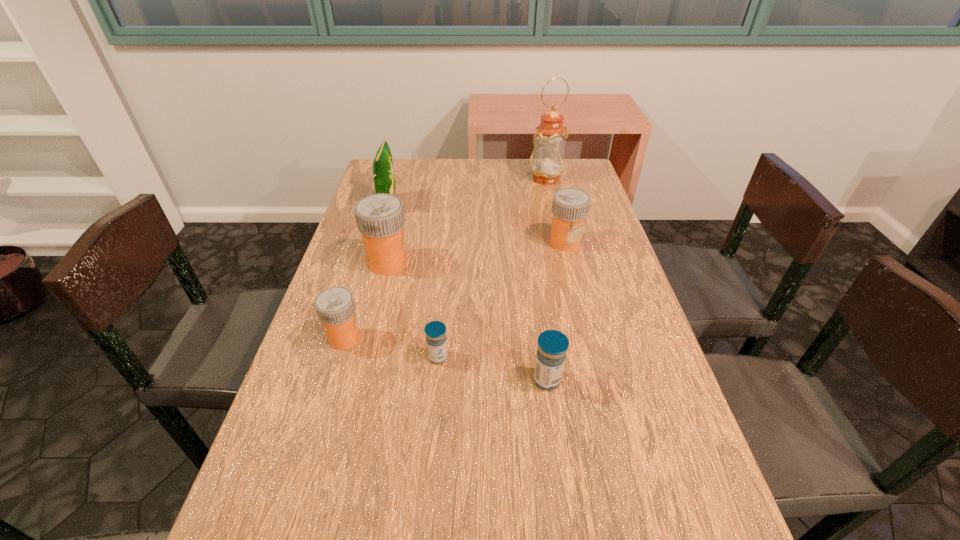
Where is `the farther blue medicine`? This screenshot has width=960, height=540. the farther blue medicine is located at coordinates (435, 331).

You are a GUI agent. You are given a task and a screenshot of the screen. Output one action in this format:
    pyautogui.click(x=<x>, y=<y>)
    Task: Click on the third medicine from right to left
    The height and width of the screenshot is (540, 960).
    Given the screenshot: What is the action you would take?
    pyautogui.click(x=435, y=331)

At what (x,y) coordinates should I click in order to perform the action: click on vacant region located 0.090m on the back of the tallest object. Please return your answer as a coordinate pair (x, y). The height and width of the screenshot is (540, 960). Looking at the image, I should click on (541, 160).

Where is `blank space located 0.140m on the front-facing side of the green crisp (potato chip)`? The width and height of the screenshot is (960, 540). blank space located 0.140m on the front-facing side of the green crisp (potato chip) is located at coordinates (441, 205).

Identify the location of free space located on the label side of the tallest medicine. The height and width of the screenshot is (540, 960). [487, 262].

Locate an element on the screen. The height and width of the screenshot is (540, 960). free space located on the label side of the rightmost medicine is located at coordinates (583, 315).

You are a GUI agent. You are given a task and a screenshot of the screen. Output one action in this format:
    pyautogui.click(x=<x>, y=<y>)
    Task: Click on the free space located on the label side of the smallest orange medicine
    The width and height of the screenshot is (960, 540).
    Given the screenshot: What is the action you would take?
    pyautogui.click(x=487, y=338)

Find the location of a particular element. vacant space located on the left of the bigger blue medicine is located at coordinates (479, 380).

You are a GUI agent. You are given a task and a screenshot of the screen. Output one action in this format:
    pyautogui.click(x=<x>, y=<y>)
    Task: Click on the free space located 0.120m on the back of the third medicine from right to left
    
    Given the screenshot: What is the action you would take?
    pyautogui.click(x=443, y=310)

Find the location of a particular element. object situated at the far edge is located at coordinates (546, 162).